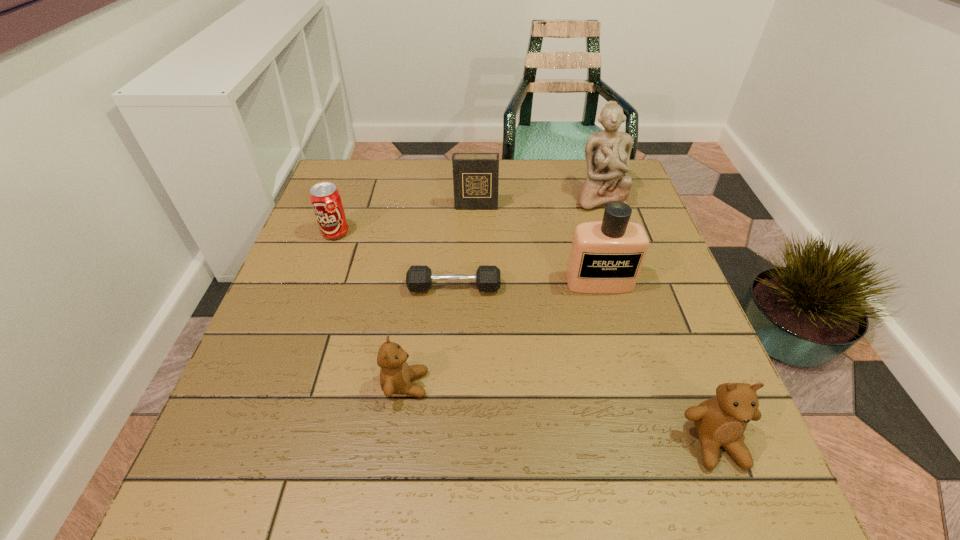
I want to click on the shorter teddy bear, so click(x=395, y=375).

At what (x,y) coordinates should I click in order to perform the action: click on the left teddy bear. Please return your answer as a coordinate pair (x, y). Looking at the image, I should click on (395, 375).

Find the location of a particular element. the nearest object is located at coordinates tap(720, 421).

At what (x,y) coordinates should I click in order to perform the action: click on the nearer teddy bear. Please return your answer as a coordinate pair (x, y). The height and width of the screenshot is (540, 960). Looking at the image, I should click on tap(720, 421).

Where is `the tallest object`? the tallest object is located at coordinates (607, 153).

The image size is (960, 540). Find the location of `the leftmost object`. the leftmost object is located at coordinates (325, 198).

This screenshot has height=540, width=960. Identify the location of soda. (325, 198).

At what (x,y) coordinates should I click in order to perform the action: click on diary. Please return your answer as a coordinate pair (x, y). The image size is (960, 540). Looking at the image, I should click on (475, 175).

You are a GUI agent. You are given a task and a screenshot of the screen. Output one action in this format:
    pyautogui.click(x=<x>, y=<y>)
    Task: Click on the second tallest object
    This screenshot has width=960, height=540.
    Given the screenshot: What is the action you would take?
    pyautogui.click(x=606, y=257)

Where is `the shortest object`? This screenshot has width=960, height=540. the shortest object is located at coordinates (418, 278).